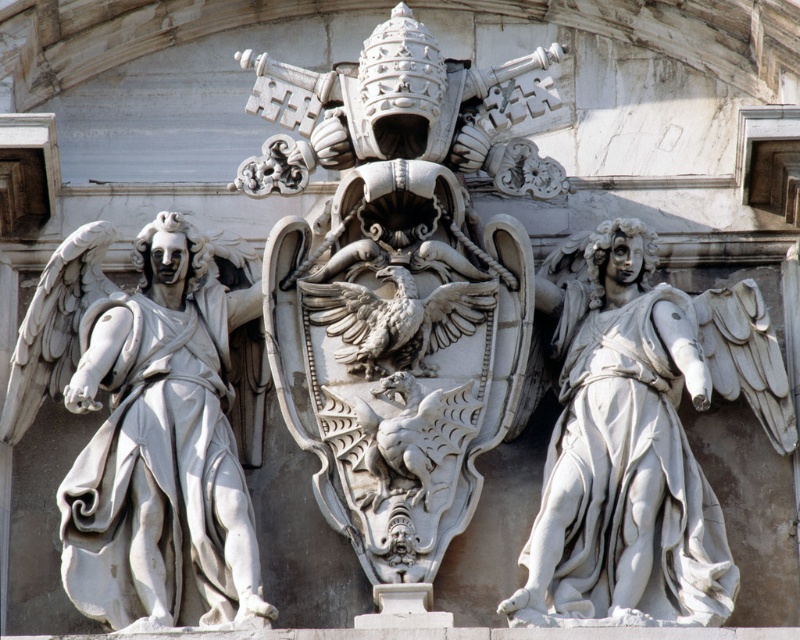
You are an art conservator assessing the stone sculpture. You notice two white marble angels flanking the central shield. Which of the two angels, the white marble angel at left or the white marble angel at right, requires a taller ladder to reach its highest point?

The white marble angel at left is taller than the white marble angel at right, so you will need a taller ladder to reach its highest point.